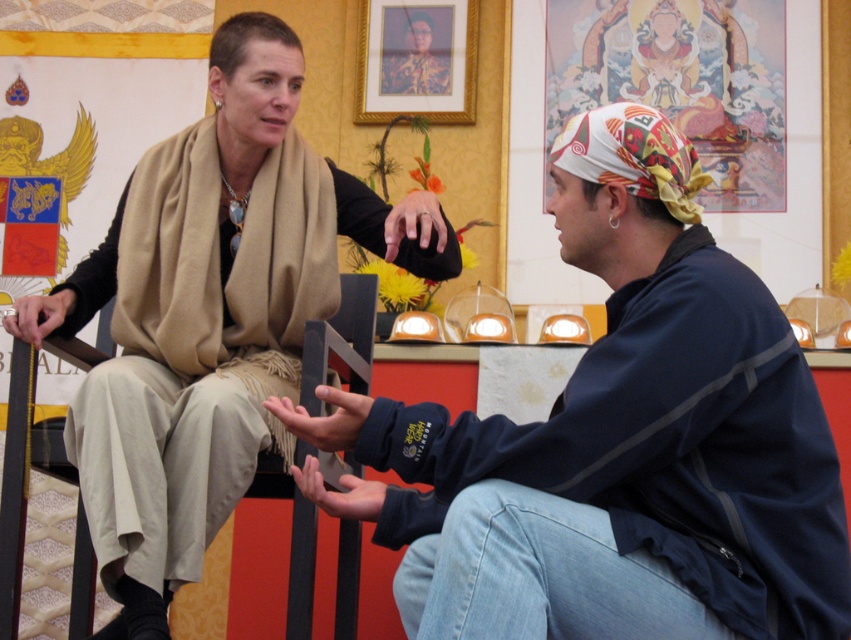
Question: Can you confirm if beige wool scarf at upper left is bigger than wooden chair at center?

Choices:
 (A) yes
 (B) no

Answer: (A)

Question: Is wooden chair at center to the left of gold-framed portrait at upper center from the viewer's perspective?

Choices:
 (A) no
 (B) yes

Answer: (B)

Question: Estimate the real-world distances between objects in this image. Which object is farther from the matte black jacket at center?

Choices:
 (A) gold-framed portrait at upper center
 (B) beige wool scarf at upper left

Answer: (A)

Question: Which object appears closest to the camera in this image?

Choices:
 (A) matte black jacket at center
 (B) gold-framed portrait at upper center

Answer: (A)

Question: Can you confirm if beige wool scarf at upper left is positioned above gold-framed portrait at upper center?

Choices:
 (A) no
 (B) yes

Answer: (A)

Question: Which is nearer to the gold-framed portrait at upper center?

Choices:
 (A) matte black jacket at center
 (B) wooden chair at center
 (C) beige wool scarf at upper left

Answer: (C)